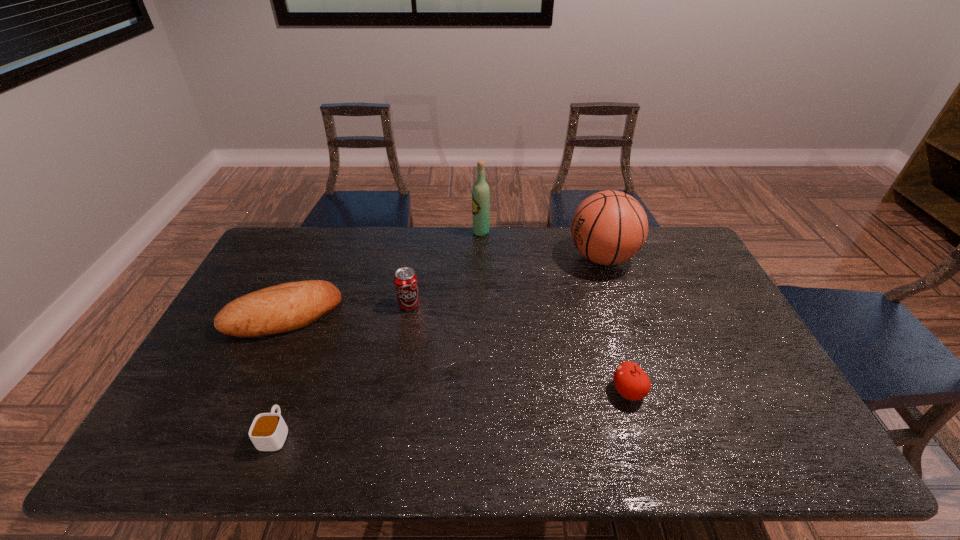
The height and width of the screenshot is (540, 960). I want to click on free point between the fifth shortest object and the bread, so click(443, 286).

You are a GUI agent. You are given a task and a screenshot of the screen. Output one action in this format:
    pyautogui.click(x=<x>, y=<y>)
    Task: Click on the vacant area between the second tallest object and the nearest object
    
    Given the screenshot: What is the action you would take?
    pyautogui.click(x=439, y=345)

Locate which object is the fifth closest to the tallest object. Please provide its 2D coordinates. Your answer should be formatted as a tuple, i.e. [(x, y)], where the tuple contains the x and y coordinates of a point satisfying the conditions above.

[(268, 432)]

Where is `object that is the third nearest to the bread`? The image size is (960, 540). object that is the third nearest to the bread is located at coordinates (480, 192).

The image size is (960, 540). In order to click on free space that satisfies the following two spatial constraints: 1. on the side with the handle of the soda; 2. on the left side of the nearest object in this screenshot , I will do [x=324, y=305].

Identify the location of vacant space that satisfies the following two spatial constraints: 1. on the surface of the basketball near the brand logo; 2. on the front side of the apple. The image size is (960, 540). (647, 392).

Where is `free spot that satisfies the following two spatial constraints: 1. on the surface of the second tallest object near the brand logo; 2. on the front side of the fifth farthest object`? free spot that satisfies the following two spatial constraints: 1. on the surface of the second tallest object near the brand logo; 2. on the front side of the fifth farthest object is located at coordinates (647, 392).

I want to click on free spot that satisfies the following two spatial constraints: 1. on the front-facing side of the third object from right to left; 2. on the front side of the fourth object from right to left, so click(x=481, y=305).

You are a GUI agent. You are given a task and a screenshot of the screen. Output one action in this format:
    pyautogui.click(x=<x>, y=<y>)
    Task: Click on the vacant space that satisfies the following two spatial constraints: 1. on the side with the handle of the shortest object; 2. on the right side of the second nearest object
    The width and height of the screenshot is (960, 540).
    Given the screenshot: What is the action you would take?
    pyautogui.click(x=292, y=392)